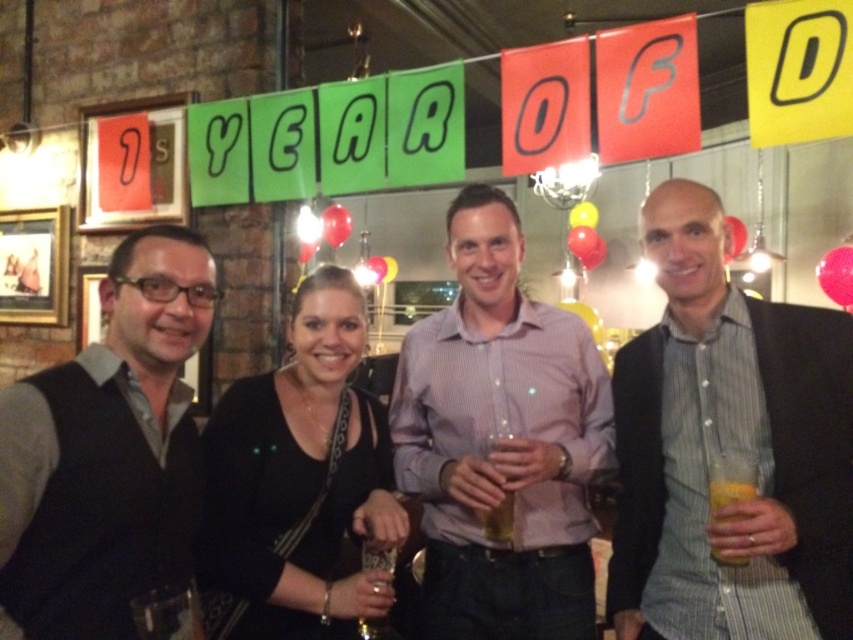
Can you confirm if purple striped shirt at center is shorter than black leather jacket at center?

Incorrect, purple striped shirt at center's height does not fall short of black leather jacket at center's.

Does point (465, 611) lie in front of point (308, 346)?

That is False.

Who is more distant from viewer, (595, 531) or (310, 312)?

The point (595, 531) is more distant.

I want to click on purple striped shirt at center, so click(x=502, y=442).

You are a GUI agent. You are given a task and a screenshot of the screen. Output one action in this format:
    pyautogui.click(x=<x>, y=<y>)
    Task: Click on the gray striped shirt at center
    This screenshot has width=853, height=640.
    Given the screenshot: What is the action you would take?
    pyautogui.click(x=729, y=449)

Does point (815, 630) lie behind point (485, 474)?

No, (815, 630) is closer to viewer.

Does point (720, 266) come closer to viewer compared to point (532, 371)?

That is True.

At what (x,y) coordinates should I click in order to perform the action: click on gray striped shirt at center. Please return your answer as a coordinate pair (x, y). Looking at the image, I should click on (729, 449).

Is dark gray sweater vest at left to the right of translucent plastic cup at right from the viewer's perspective?

No, dark gray sweater vest at left is not to the right of translucent plastic cup at right.

Does point (117, 340) come farther from viewer compared to point (712, 502)?

No, (117, 340) is in front of (712, 502).

I want to click on dark gray sweater vest at left, so click(x=108, y=451).